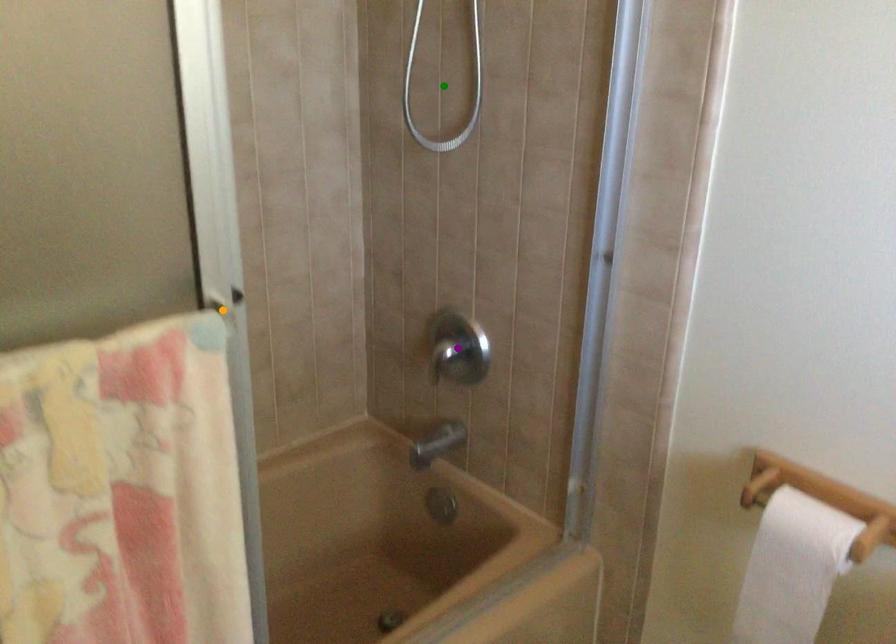
Order these from nearest to farthest:
- green point
- purple point
- orange point

orange point → green point → purple point